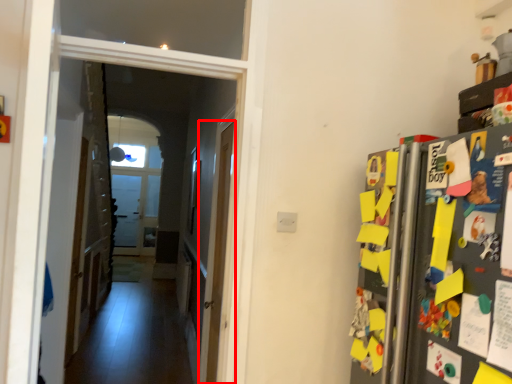
Question: From the image's perspective, where is door (annotated by the red box) located relative to corridor?

Choices:
 (A) below
 (B) above

Answer: (A)